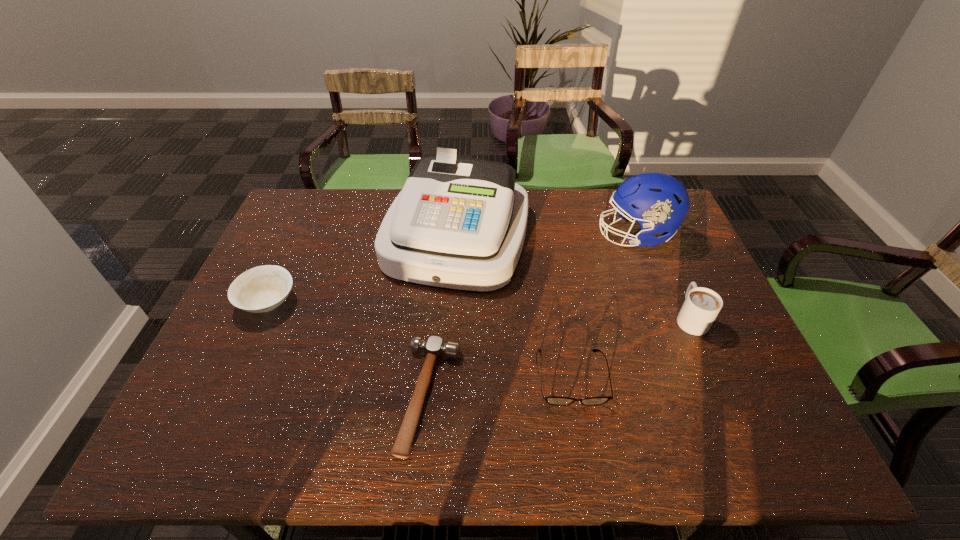
Where is `object at the left edge`? This screenshot has height=540, width=960. object at the left edge is located at coordinates (261, 289).

At what (x,y) coordinates should I click in order to perform the action: click on football helmet that is at the right edge. Please return your answer as a coordinate pair (x, y). This screenshot has width=960, height=540. Looking at the image, I should click on (659, 203).

Where is `cappuccino present at the right edge`? The width and height of the screenshot is (960, 540). cappuccino present at the right edge is located at coordinates (701, 306).

At what (x,y) coordinates should I click in order to perform the action: click on object located in the far right corner section of the desktop. Please return your answer as a coordinate pair (x, y). Image resolution: width=960 pixels, height=540 pixels. Looking at the image, I should click on (659, 203).

Where is `free space at the far edge`? Image resolution: width=960 pixels, height=540 pixels. free space at the far edge is located at coordinates (349, 204).

Locate an element on the screen. The width and height of the screenshot is (960, 540). vacant space at the near edge is located at coordinates (490, 439).

Identify the location of free region at the right edge of the desktop. The width and height of the screenshot is (960, 540). (655, 255).

In the image, there is a desktop. Where is `vacant space at the far left corner`? The height and width of the screenshot is (540, 960). vacant space at the far left corner is located at coordinates (295, 232).

Image resolution: width=960 pixels, height=540 pixels. In order to click on free spot at the near left corner of the desktop in this screenshot , I will do `click(228, 424)`.

Locate an element on the screen. vacant point located between the leftmost object and the cappuccino is located at coordinates (479, 310).